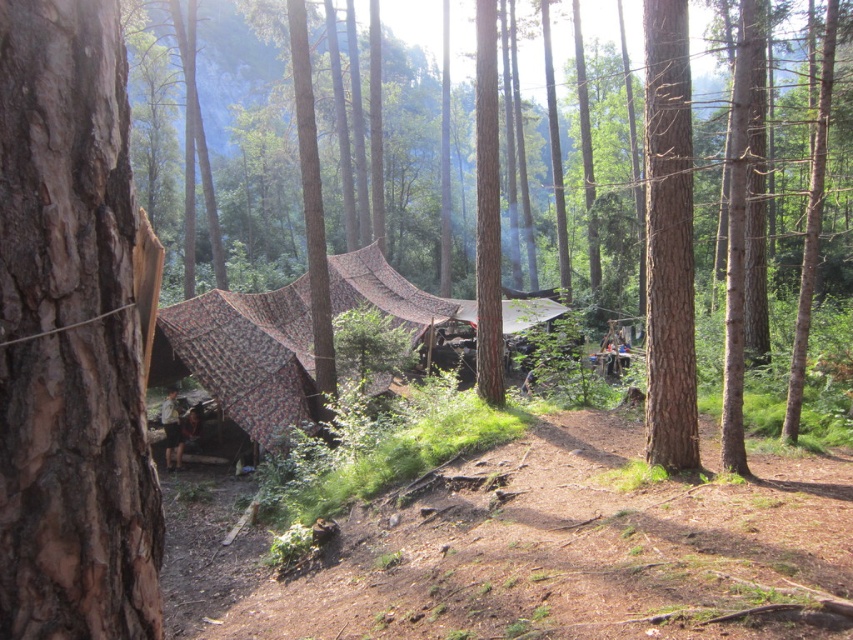
You are a hiker who wants to identify the tree closest to the tents. You see the brown rough bark at left and the brown rough bark tree at left. Which one is closer to the tents?

The brown rough bark at left is closer to the tents because it is smaller in size compared to the brown rough bark tree at left, implying it is positioned in the foreground nearer to the tents.

You are a hiker trying to navigate through the forest. You see the brown rough bark tree at left and the smooth brown tree trunk at right. Which tree is closer to you?

The brown rough bark tree at left is closer to you because it is in front of the smooth brown tree trunk at right.